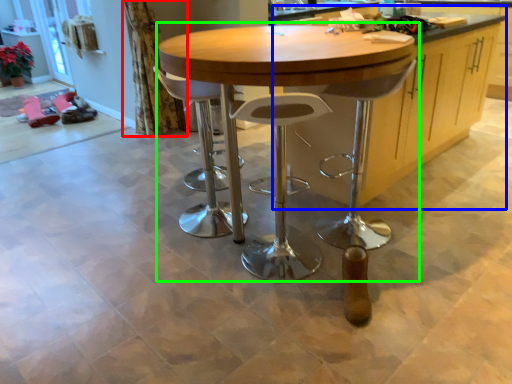
Question: Estimate the real-world distances between objects in this image. Which object is farther from curtain (highlighted by a red box), cabinetry (highlighted by a blue box) or table (highlighted by a green box)?

Choices:
 (A) cabinetry
 (B) table

Answer: (A)